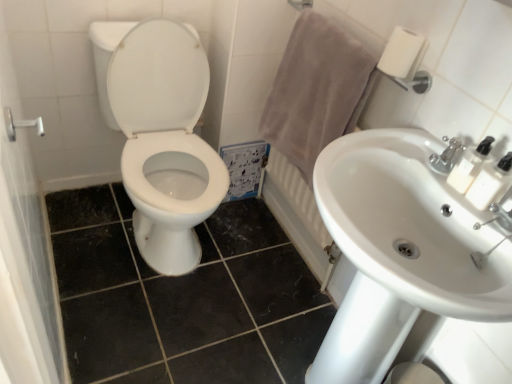
Where is `white glossy sink at center right`? white glossy sink at center right is located at coordinates (411, 225).

The height and width of the screenshot is (384, 512). Describe the element at coordinates (165, 141) in the screenshot. I see `white glossy toilet at center` at that location.

Identify the location of white ceramic radiator at upper right. (305, 225).

In order to face white matte toilet paper at upper right, should I rotate leftwards or rightwards?

Turn right approximately 18.638 degrees to face it.

Image resolution: width=512 pixels, height=384 pixels. I want to click on white matte toilet paper at upper right, so click(400, 53).

The image size is (512, 384). In order to click on white plastic soap dispenser at upper right, acting as the first soap dispenser starting from the bottom in this screenshot , I will do `click(490, 183)`.

Which is closer, (420, 259) or (477, 183)?

Positioned in front is point (477, 183).

Does white glossy sink at center right have a larger size compared to white plastic soap dispenser at upper right, acting as the first soap dispenser starting from the bottom?

Indeed, white glossy sink at center right has a larger size compared to white plastic soap dispenser at upper right, acting as the first soap dispenser starting from the bottom.

Consider the image. Who is more distant, white glossy sink at center right or white plastic soap dispenser at upper right, acting as the first soap dispenser starting from the bottom?

white plastic soap dispenser at upper right, acting as the first soap dispenser starting from the bottom, is further away from the camera.

Which object is more forward, white glossy toilet at center or white plastic soap dispenser at upper right, marked as the second soap dispenser in a bottom-to-top arrangement?

Positioned in front is white plastic soap dispenser at upper right, marked as the second soap dispenser in a bottom-to-top arrangement.

Is white glossy toilet at center facing away from white plastic soap dispenser at upper right, marked as the second soap dispenser in a bottom-to-top arrangement?

No, white glossy toilet at center's orientation is not away from white plastic soap dispenser at upper right, marked as the second soap dispenser in a bottom-to-top arrangement.

Would you say white glossy toilet at center is a long distance from white plastic soap dispenser at upper right, which ranks as the 1th soap dispenser in top-to-bottom order?

Yes.

Measure the distance between white glossy toilet at center and white plastic soap dispenser at upper right, marked as the second soap dispenser in a bottom-to-top arrangement.

1.01 meters.

Considering the relative sizes of white ceramic radiator at upper right and white matte toilet paper at upper right in the image provided, is white ceramic radiator at upper right thinner than white matte toilet paper at upper right?

Yes, white ceramic radiator at upper right is thinner than white matte toilet paper at upper right.

From a real-world perspective, which object rests below the other?

In real-world perspective, white ceramic radiator at upper right is lower.

Is white matte toilet paper at upper right at the back of white ceramic radiator at upper right?

No, white ceramic radiator at upper right's orientation is not away from white matte toilet paper at upper right.

Can white matte toilet paper at upper right be found inside white ceramic radiator at upper right?

No, white matte toilet paper at upper right is not a part of white ceramic radiator at upper right.

Is satin nickel faucet at upper right positioned in front of beige cotton towel at upper right?

That is True.

Would you say satin nickel faucet at upper right is a long distance from beige cotton towel at upper right?

That's not correct — satin nickel faucet at upper right is a little close to beige cotton towel at upper right.

Can you tell me how much satin nickel faucet at upper right and beige cotton towel at upper right differ in facing direction?

satin nickel faucet at upper right and beige cotton towel at upper right are facing 0.144 degrees away from each other.

Considering the sizes of objects white ceramic radiator at upper right and beige cotton towel at upper right in the image provided, who is smaller, white ceramic radiator at upper right or beige cotton towel at upper right?

With smaller size is white ceramic radiator at upper right.

From a real-world perspective, is white ceramic radiator at upper right under beige cotton towel at upper right?

Correct, in the physical world, white ceramic radiator at upper right is lower than beige cotton towel at upper right.

Considering the sizes of objects white ceramic radiator at upper right and beige cotton towel at upper right in the image provided, who is taller, white ceramic radiator at upper right or beige cotton towel at upper right?

white ceramic radiator at upper right.

Considering the relative positions of white ceramic radiator at upper right and beige cotton towel at upper right in the image provided, is white ceramic radiator at upper right to the left or to the right of beige cotton towel at upper right?

Clearly, white ceramic radiator at upper right is on the right of beige cotton towel at upper right in the image.

Which of these two, brushed metal shower handle at left or white glossy toilet at center, is wider?

With larger width is white glossy toilet at center.

From a real-world perspective, who is located higher, brushed metal shower handle at left or white glossy toilet at center?

brushed metal shower handle at left, from a real-world perspective.

The height and width of the screenshot is (384, 512). I want to click on shower located on the left of white glossy toilet at center, so click(x=21, y=124).

From the image's perspective, is white ceramic radiator at upper right located beneath white ceramic faucet at upper right?

No.

Between white ceramic radiator at upper right and white ceramic faucet at upper right, which one has smaller size?

Smaller between the two is white ceramic faucet at upper right.

Is point (281, 179) farther from viewer compared to point (499, 219)?

Yes, point (281, 179) is farther from viewer.

Could you tell me if white ceramic radiator at upper right is facing white ceramic faucet at upper right?

No, white ceramic radiator at upper right is not aimed at white ceramic faucet at upper right.

I want to click on the 1st soap dispenser directly above the white glossy sink at center right (from a real-world perspective), so pos(490,183).

The height and width of the screenshot is (384, 512). I want to click on toilet that is on the left side of white plastic soap dispenser at upper right, marked as the second soap dispenser in a bottom-to-top arrangement, so click(x=165, y=141).

Considering their positions, is brushed metal shower handle at left positioned further to beige cotton towel at upper right than white plastic soap dispenser at upper right, marked as the second soap dispenser in a bottom-to-top arrangement?

Among the two, brushed metal shower handle at left is located further to beige cotton towel at upper right.

From the image, which object appears to be nearer to white ceramic faucet at upper right, white matte toilet paper at upper right or beige cotton towel at upper right?

white matte toilet paper at upper right is positioned closer to the anchor white ceramic faucet at upper right.

Based on their spatial positions, is white ceramic faucet at upper right or white plastic soap dispenser at upper right, which is counted as the second soap dispenser, starting from the top, closer to white plastic soap dispenser at upper right, marked as the second soap dispenser in a bottom-to-top arrangement?

white plastic soap dispenser at upper right, which is counted as the second soap dispenser, starting from the top.

Looking at the image, which one is located further to white ceramic radiator at upper right, white ceramic faucet at upper right or white glossy toilet at center?

Based on the image, white ceramic faucet at upper right appears to be further to white ceramic radiator at upper right.

In the scene shown: Which object lies nearer to the anchor point brushed metal shower handle at left, white ceramic faucet at upper right or white ceramic radiator at upper right?

The object closer to brushed metal shower handle at left is white ceramic faucet at upper right.

Considering their positions, is white glossy sink at center right positioned closer to white matte toilet paper at upper right than beige cotton towel at upper right?

Among the two, beige cotton towel at upper right is located nearer to white matte toilet paper at upper right.

Which object lies nearer to the anchor point beige cotton towel at upper right, white plastic soap dispenser at upper right, marked as the second soap dispenser in a bottom-to-top arrangement, or satin nickel faucet at upper right?

Based on the image, satin nickel faucet at upper right appears to be nearer to beige cotton towel at upper right.

Which object lies further to the anchor point white glossy toilet at center, white plastic soap dispenser at upper right, marked as the second soap dispenser in a bottom-to-top arrangement, or satin nickel faucet at upper right?

white plastic soap dispenser at upper right, marked as the second soap dispenser in a bottom-to-top arrangement.

Where is `tap located between white glossy toilet at center and white ceramic faucet at upper right in the left-right direction`? This screenshot has width=512, height=384. tap located between white glossy toilet at center and white ceramic faucet at upper right in the left-right direction is located at coordinates (445, 156).

Locate an element on the screen. bath towel located between brushed metal shower handle at left and satin nickel faucet at upper right in the left-right direction is located at coordinates pyautogui.click(x=315, y=91).

This screenshot has width=512, height=384. I want to click on bath towel that lies between white matte toilet paper at upper right and white ceramic faucet at upper right from top to bottom, so click(315, 91).

I want to click on sink between brushed metal shower handle at left and white plastic soap dispenser at upper right, which is counted as the second soap dispenser, starting from the top, from left to right, so click(411, 225).